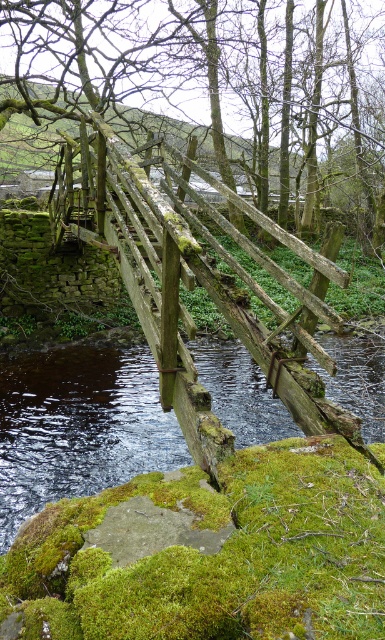
Question: Which point is closer to the camera taking this photo?

Choices:
 (A) (286, 120)
 (B) (231, 372)

Answer: (B)

Question: Can you confirm if black water at center is thinner than rusty wood rail at center?

Choices:
 (A) yes
 (B) no

Answer: (B)

Question: Is green mossy tree at center smaller than rusty wood rail at center?

Choices:
 (A) no
 (B) yes

Answer: (A)

Question: Can you confirm if black water at center is positioned above rusty wood rail at center?

Choices:
 (A) no
 (B) yes

Answer: (A)

Question: Which point is closer to the camera?

Choices:
 (A) black water at center
 (B) rusty wood rail at center
 (C) green mossy tree at center

Answer: (C)

Question: Which object appears farthest from the camera in this image?

Choices:
 (A) rusty wood rail at center
 (B) green mossy tree at center
 (C) black water at center

Answer: (A)